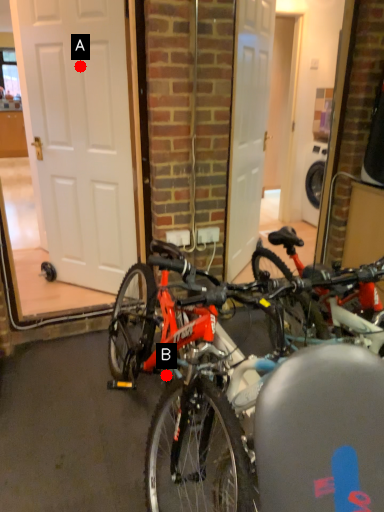
Question: Two points are circled on the image, labeled by A and B beside each circle. Among these points, which one is farthest from the camera?

Choices:
 (A) A is further
 (B) B is further

Answer: (A)